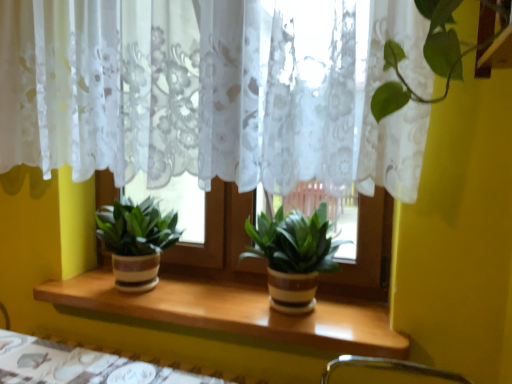
Question: From a real-world perspective, is green matte plant at center, which ranks as the first houseplant in right-to-left order, positioned above or below wooden at center?

Choices:
 (A) below
 (B) above

Answer: (B)

Question: Is point (298, 221) positioned closer to the camera than point (336, 344)?

Choices:
 (A) closer
 (B) farther

Answer: (B)

Question: Which of these objects is positioned farthest from the white lace curtain at center?

Choices:
 (A) green matte plant at center, which ranks as the first houseplant in right-to-left order
 (B) wooden table at lower center
 (C) wooden at center
 (D) green matte plant at center, the 2th houseplant viewed from the right

Answer: (B)

Question: Estimate the real-world distances between objects in this image. Which object is closer to the white lace curtain at center?

Choices:
 (A) wooden at center
 (B) green matte plant at center, which is counted as the first houseplant, starting from the left
 (C) wooden table at lower center
 (D) green matte plant at center, which is the 2th houseplant in left-to-right order

Answer: (D)